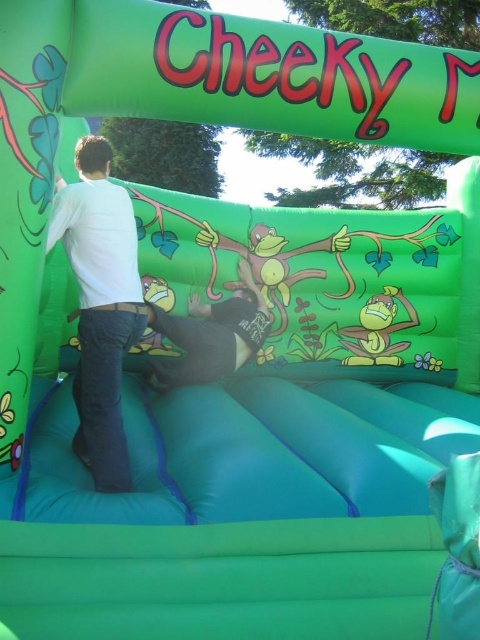
You are a parent trying to ensure your child stays within a safe distance while playing in the bouncy castle. The safety guidelines state that children must stay at least 6 feet away from any inflatable decorations. Are the white matte shirt at left and green rubber monkey at center positioned in a way that complies with the safety guidelines?

The distance between the white matte shirt at left and the green rubber monkey at center is 5.96 feet, which is slightly less than the required 6 feet. Therefore, they are not positioned in compliance with the safety guidelines.

You are standing in front of the bouncy castle and want to reach the point at coordinates point (112, 312). If your arm can stretch 1.8 meters, can you reach it?

The point (112, 312) is 1.92 meters away from the camera, so you cannot reach it with an arm stretch of 1.8 meters.

You are a parent supervising children playing in the bouncy castle. You notice a soft black shirt at center and a green rubber monkey at center. Which object is closer to the entrance of the bouncy castle?

The soft black shirt at center is closer to the entrance because it is positioned to the left of the green rubber monkey at center, which might be near the center of the structure where the entrance is typically located.